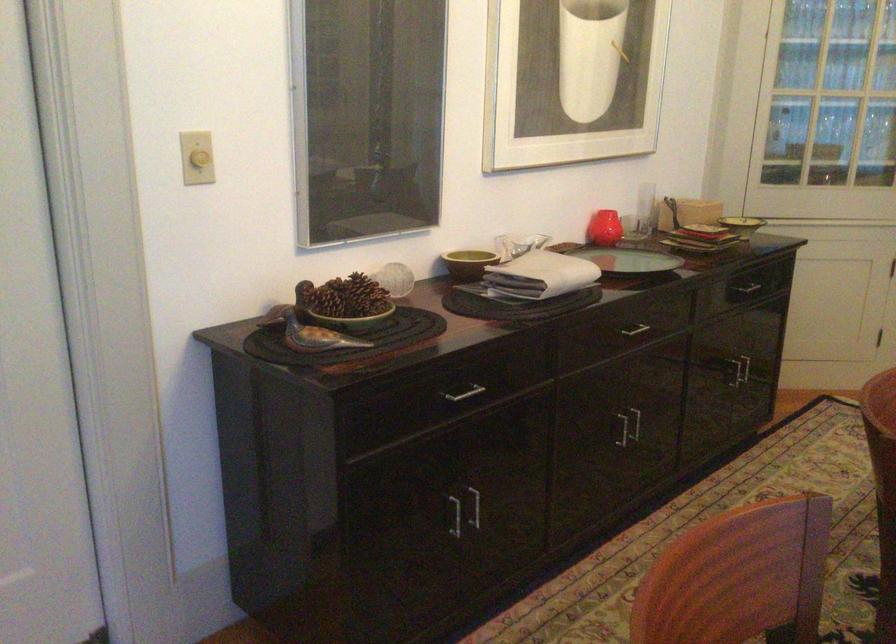
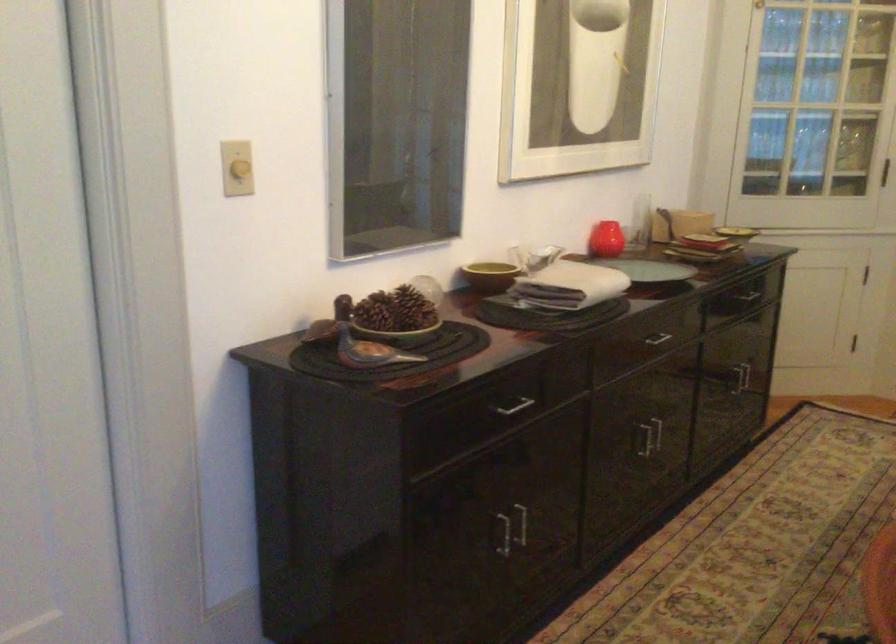
Question: The camera is either moving clockwise (left) or counter-clockwise (right) around the object. The first image is from the beginning of the video and the second image is from the end. Is the camera moving left or right when shooting the video?

Choices:
 (A) Left
 (B) Right

Answer: (A)